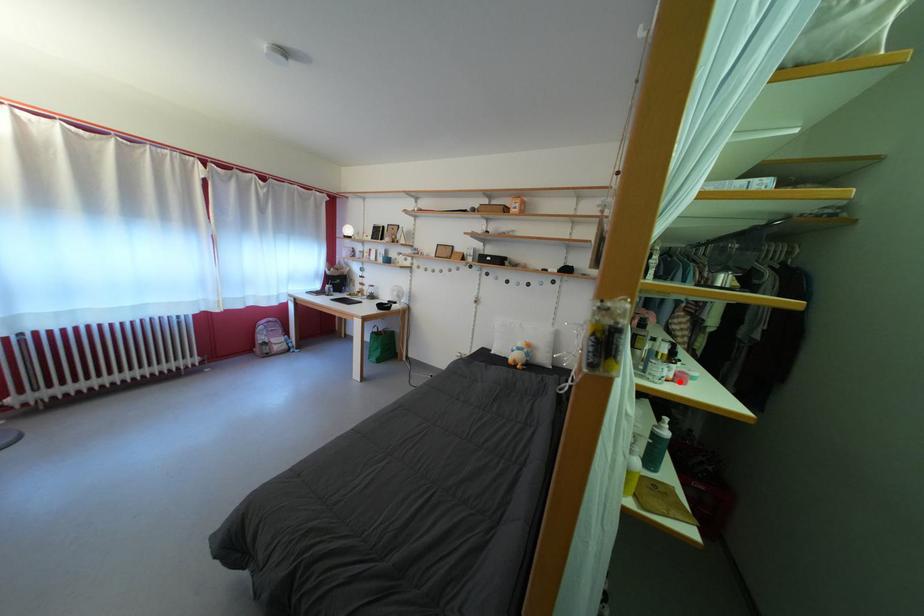
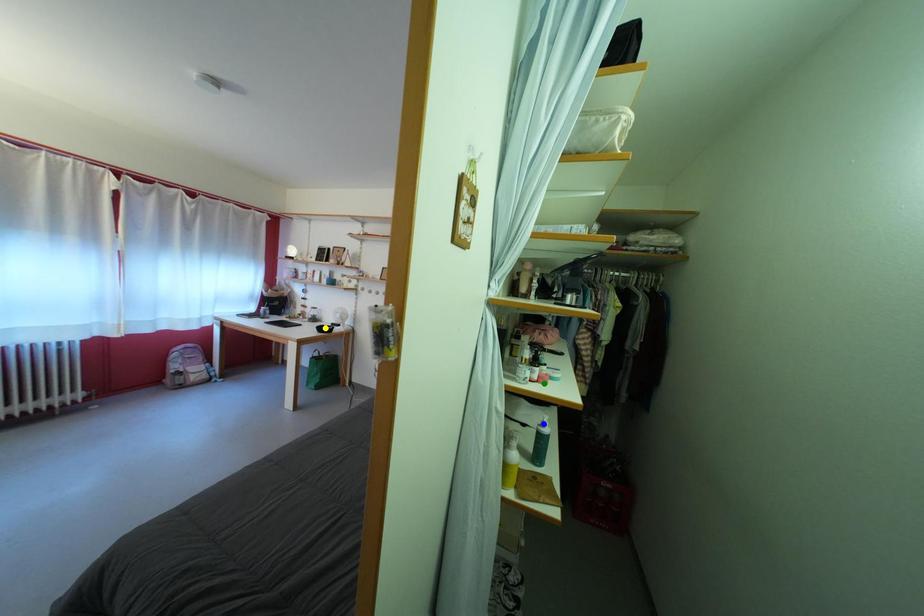
Question: I am providing you with two images of the same scene from different viewpoints. A red point is marked on the first image. You are given multiple points on the second image. Can you choose the point in image 2 that corresponds to the point in image 1?

Choices:
 (A) blue point
 (B) green point
 (C) yellow point

Answer: (B)